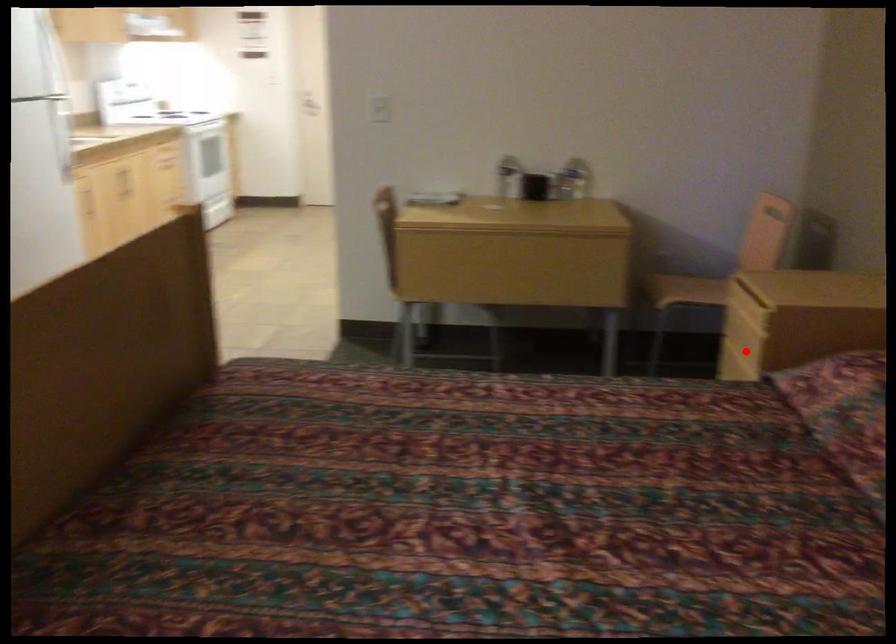
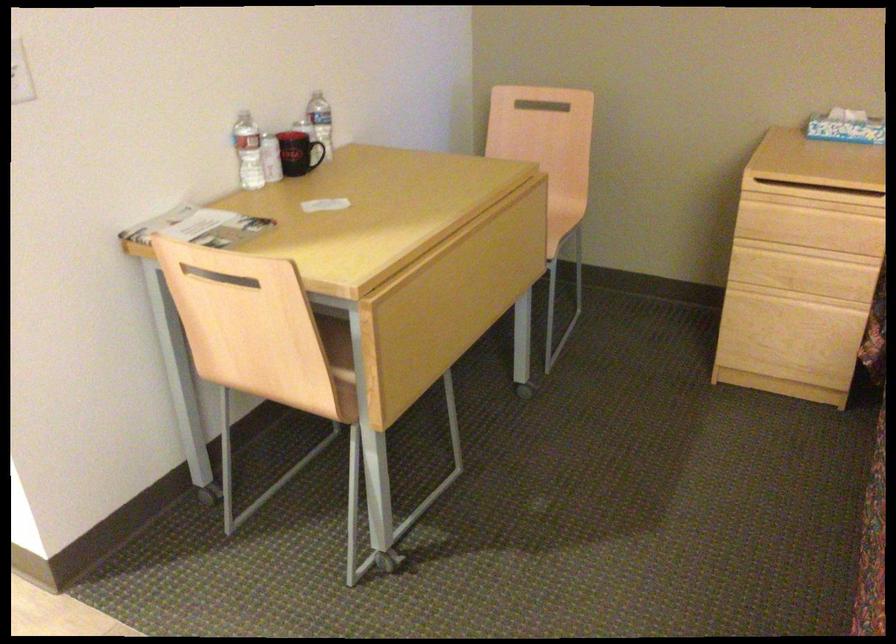
The point at the highlighted location is marked in the first image. Where is the corresponding point in the second image?

(810, 251)